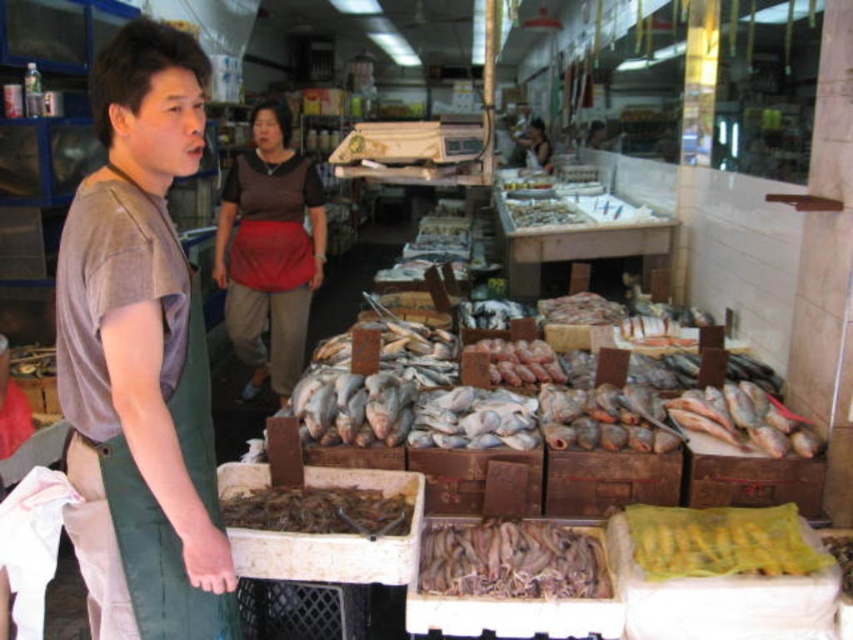
You are a customer at the fish market and want to touch the brownish matte fish at center. Can you reach it without moving the brown fabric apron at center?

The brown fabric apron at center is closer to you than the brownish matte fish at center, so you would need to move the apron to reach the fish.

You are a customer at the fish market and want to buy the brownish matte fish at center. The vendor is wearing the brown fabric apron at center. Can you see the fish clearly while talking to the vendor?

The brown fabric apron at center is taller than the brownish matte fish at center, so the apron may block your view of the fish while talking to the vendor.